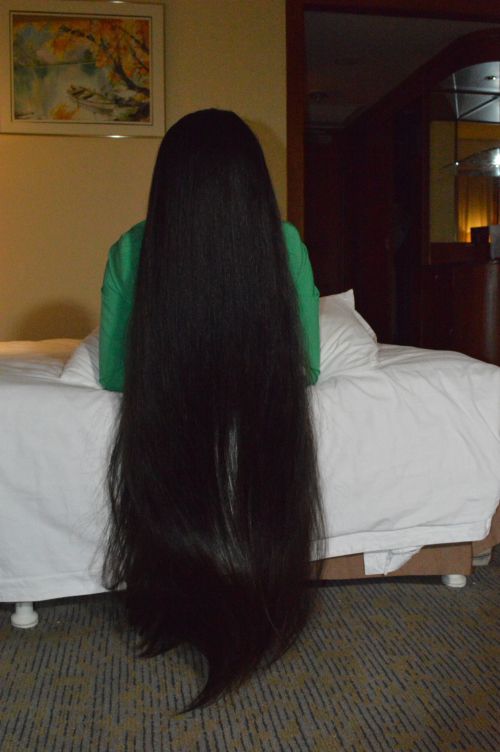
Find the location of a particular element. The height and width of the screenshot is (752, 500). floor is located at coordinates (326, 690).